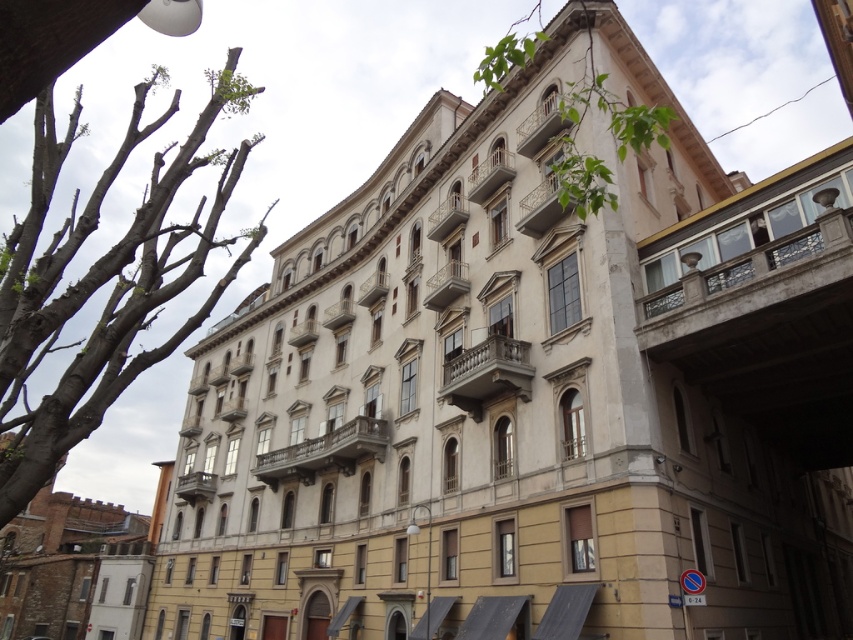
Which of these two, bare wood tree at left or green leafy tree at upper center, stands shorter?

With less height is green leafy tree at upper center.

Between point (199, 122) and point (502, 45), which one is positioned in front?

Point (502, 45) is in front.

Find the location of `bare wood tree at left`. bare wood tree at left is located at coordinates pos(103,280).